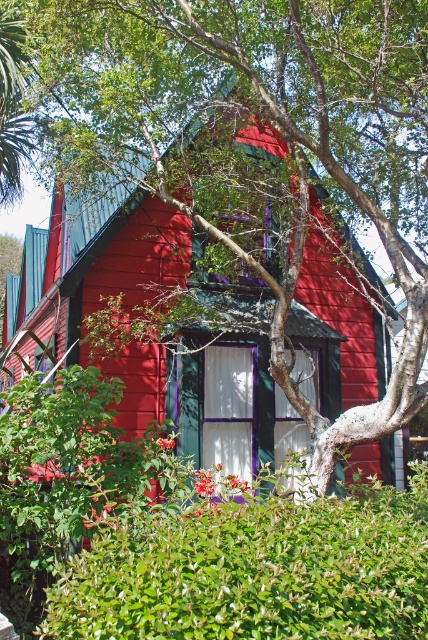
Question: Is green leafy hedge at center smaller than matte wood house at center?

Choices:
 (A) yes
 (B) no

Answer: (A)

Question: Is green leafy hedge at center wider than matte wood house at center?

Choices:
 (A) no
 (B) yes

Answer: (A)

Question: Which point is farther to the camera?

Choices:
 (A) (17, 326)
 (B) (241, 557)

Answer: (A)

Question: Is green leafy hedge at center below matte wood house at center?

Choices:
 (A) no
 (B) yes

Answer: (B)